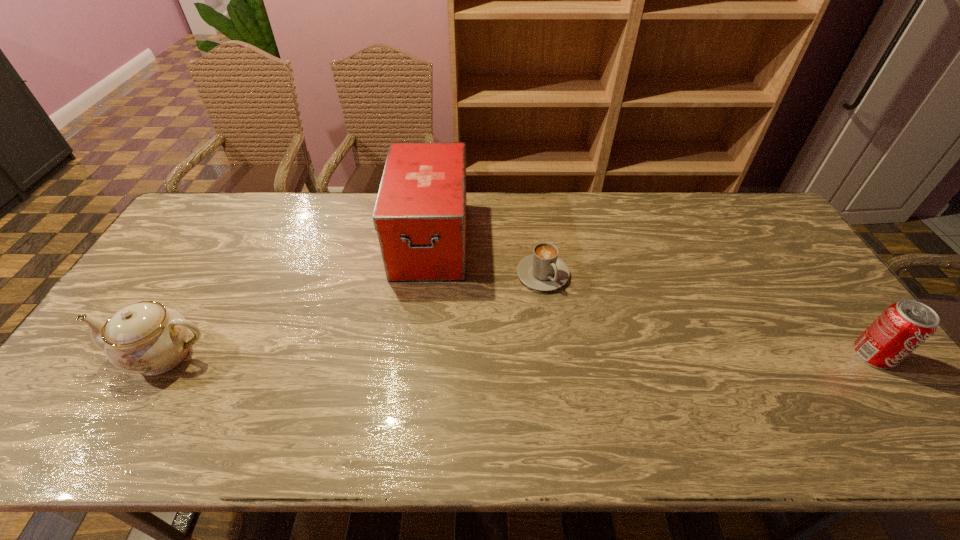
Where is `free space on the desktop that is between the leftmost object and the rightmost object and is positioned to the right of the shortest object`? This screenshot has width=960, height=540. free space on the desktop that is between the leftmost object and the rightmost object and is positioned to the right of the shortest object is located at coordinates (602, 355).

The image size is (960, 540). What are the coordinates of `free space on the desktop that is between the chinaware and the rightmost object and is positioned on the handle side of the first-aid kit` in the screenshot? It's located at (420, 355).